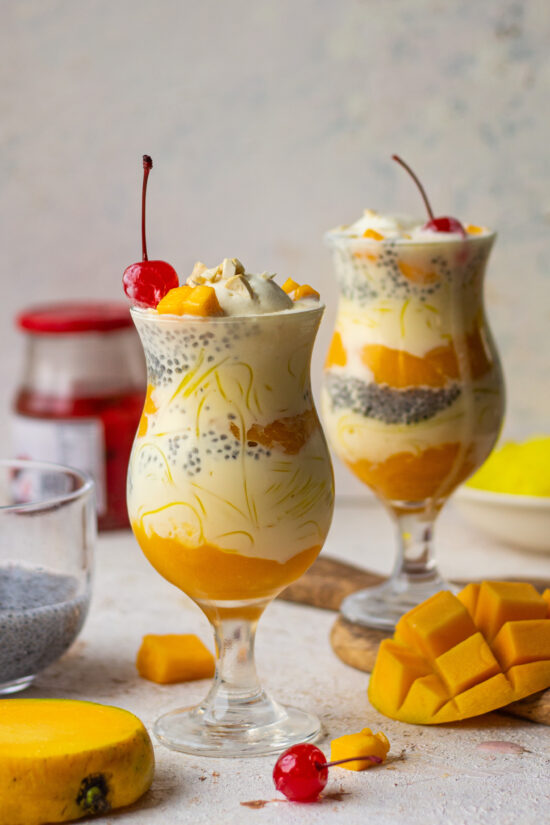
Where is `cutting board`? This screenshot has width=550, height=825. cutting board is located at coordinates (356, 653).